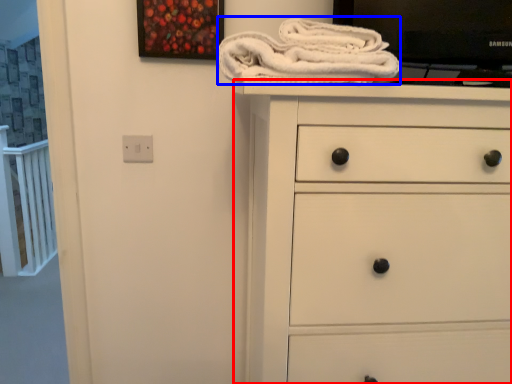
Question: Which object is closer to the camera taking this photo, chest of drawers (highlighted by a red box) or bath towel (highlighted by a blue box)?

Choices:
 (A) chest of drawers
 (B) bath towel

Answer: (A)